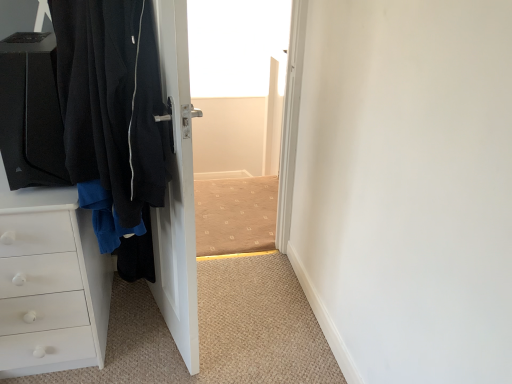
Find the location of `black fabric door at left`. black fabric door at left is located at coordinates (177, 190).

Measure the distance between point (x=194, y=361) and camera.

Point (x=194, y=361) and camera are 1.58 meters apart from each other.

In order to face black fabric door at left, should I rotate leftwards or rightwards?

To align with it, rotate left about 13.581°.

Describe the element at coordinates (177, 190) in the screenshot. I see `black fabric door at left` at that location.

Locate an element on the screen. The width and height of the screenshot is (512, 384). white matte chest of drawers at left is located at coordinates (51, 283).

What do you see at coordinates (51, 283) in the screenshot?
I see `white matte chest of drawers at left` at bounding box center [51, 283].

Find the location of `black fabric door at left`. black fabric door at left is located at coordinates (177, 190).

Considering the relative positions of black fabric door at left and white matte chest of drawers at left in the image provided, is black fabric door at left to the right of white matte chest of drawers at left from the viewer's perspective?

Yes, black fabric door at left is to the right of white matte chest of drawers at left.

Relative to white matte chest of drawers at left, is black fabric door at left in front or behind?

In the image, black fabric door at left appears in front of white matte chest of drawers at left.

Does point (154, 254) lie in front of point (50, 195)?

That is False.

From the image's perspective, which is below, black fabric door at left or white matte chest of drawers at left?

white matte chest of drawers at left is shown below in the image.

From a real-world perspective, between black fabric door at left and white matte chest of drawers at left, who is vertically lower?

white matte chest of drawers at left, from a real-world perspective.

Considering the sizes of objects black fabric door at left and white matte chest of drawers at left in the image provided, who is wider, black fabric door at left or white matte chest of drawers at left?

white matte chest of drawers at left is wider.

Considering the relative sizes of black fabric door at left and white matte chest of drawers at left in the image provided, is black fabric door at left shorter than white matte chest of drawers at left?

No, black fabric door at left is not shorter than white matte chest of drawers at left.

Considering the relative sizes of black fabric door at left and white matte chest of drawers at left in the image provided, is black fabric door at left bigger than white matte chest of drawers at left?

Incorrect, black fabric door at left is not larger than white matte chest of drawers at left.

Which is correct: black fabric door at left is inside white matte chest of drawers at left, or outside of it?

black fabric door at left cannot be found inside white matte chest of drawers at left.

Is there a large distance between black fabric door at left and white matte chest of drawers at left?

No.

Is black fabric door at left aimed at white matte chest of drawers at left?

Yes, black fabric door at left is turned towards white matte chest of drawers at left.

I want to click on door in front of the white matte chest of drawers at left, so click(177, 190).

In the image, is white matte chest of drawers at left on the left side or the right side of black fabric door at left?

white matte chest of drawers at left is to the left of black fabric door at left.

Which object is more forward, white matte chest of drawers at left or black fabric door at left?

black fabric door at left.

Is point (29, 190) in front of point (159, 45)?

No, (29, 190) is further to viewer.

From the image's perspective, is white matte chest of drawers at left above black fabric door at left?

No, from the image's perspective, white matte chest of drawers at left is not above black fabric door at left.

From a real-world perspective, is white matte chest of drawers at left located beneath black fabric door at left?

Indeed, from a real-world perspective, white matte chest of drawers at left is positioned beneath black fabric door at left.

Considering the sizes of objects white matte chest of drawers at left and black fabric door at left in the image provided, who is wider, white matte chest of drawers at left or black fabric door at left?

Wider between the two is white matte chest of drawers at left.

Considering the relative sizes of white matte chest of drawers at left and black fabric door at left in the image provided, is white matte chest of drawers at left taller than black fabric door at left?

No.

Considering the relative sizes of white matte chest of drawers at left and black fabric door at left in the image provided, is white matte chest of drawers at left smaller than black fabric door at left?

No, white matte chest of drawers at left is not smaller than black fabric door at left.

Would you say white matte chest of drawers at left contains black fabric door at left?

No, black fabric door at left is not inside white matte chest of drawers at left.

Are white matte chest of drawers at left and black fabric door at left located far from each other?

No.

In the scene shown: Is white matte chest of drawers at left facing towards black fabric door at left?

No.

Measure the distance from white matte chest of drawers at left to black fabric door at left.

A distance of 15.65 inches exists between white matte chest of drawers at left and black fabric door at left.

Find the location of a particular element. The width and height of the screenshot is (512, 384). chest of drawers on the left of the black fabric door at left is located at coordinates (51, 283).

You are a GUI agent. You are given a task and a screenshot of the screen. Output one action in this format:
    pyautogui.click(x=<x>, y=<y>)
    Task: Click on the chest of drawers on the left of black fabric door at left
    
    Given the screenshot: What is the action you would take?
    pyautogui.click(x=51, y=283)

Identify the location of chest of drawers below the black fabric door at left (from the image's perspective). (51, 283).